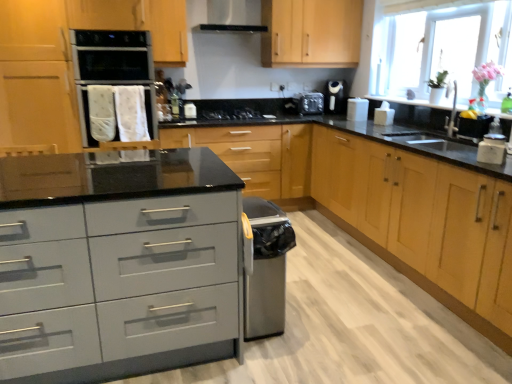
This screenshot has width=512, height=384. What do you see at coordinates (120, 287) in the screenshot?
I see `matte gray drawer at center` at bounding box center [120, 287].

I want to click on satin grey drawers at center, the second cabinetry when ordered from right to left, so click(x=390, y=205).

I want to click on matte wood oven at left, arranged as the 3th cabinetry when viewed from the right, so click(68, 59).

Find the location of a particular element. Image resolution: width=512 pixels, height=384 pixels. transparent glass window at upper right is located at coordinates (440, 48).

Between black matte gas stove at center and satin black oven at upper center, which one has smaller size?

black matte gas stove at center is smaller.

Is black matte gas stove at center positioned far away from satin black oven at upper center?

Yes, black matte gas stove at center is far from satin black oven at upper center.

Is black matte gas stove at center behind satin black oven at upper center?

Yes, black matte gas stove at center is further from the viewer.

Is black matte gas stove at center looking in the opposite direction of satin black oven at upper center?

No.

Which object is further away from the camera, transparent glass window at upper right or white glossy toaster at upper right, which is the first appliance from right to left?

white glossy toaster at upper right, which is the first appliance from right to left, is more distant.

Could you tell me if transparent glass window at upper right is turned towards white glossy toaster at upper right, arranged as the 3th appliance when viewed from the left?

No, transparent glass window at upper right does not turn towards white glossy toaster at upper right, arranged as the 3th appliance when viewed from the left.

Who is bigger, transparent glass window at upper right or white glossy toaster at upper right, the 3th appliance when ordered from back to front?

With larger size is transparent glass window at upper right.

From a real-world perspective, is transparent glass window at upper right positioned over white glossy toaster at upper right, the first appliance from the front, based on gravity?

Yes.

Considering the positions of point (129, 44) and point (390, 117), is point (129, 44) closer or farther from the camera than point (390, 117)?

Point (129, 44).

Looking at this image, can you see white fabric oven mitts at upper left touching white glossy toaster at upper right, arranged as the 3th appliance when viewed from the left?

No, white fabric oven mitts at upper left is not next to white glossy toaster at upper right, arranged as the 3th appliance when viewed from the left.

From the image's perspective, between white fabric oven mitts at upper left and white glossy toaster at upper right, the first appliance from the front, which one is located above?

From the image's view, white fabric oven mitts at upper left is above.

Is matte wood oven at left, arranged as the 3th cabinetry when viewed from the right, thinner than matte gray drawer at center?

Correct, the width of matte wood oven at left, arranged as the 3th cabinetry when viewed from the right, is less than that of matte gray drawer at center.

In the image, is matte wood oven at left, which is the first cabinetry in left-to-right order, on the left side or the right side of matte gray drawer at center?

From the image, it's evident that matte wood oven at left, which is the first cabinetry in left-to-right order, is to the left of matte gray drawer at center.

Who is bigger, matte wood oven at left, which is the first cabinetry in left-to-right order, or matte gray drawer at center?

With larger size is matte wood oven at left, which is the first cabinetry in left-to-right order.

You are a GUI agent. You are given a task and a screenshot of the screen. Output one action in this format:
    pyautogui.click(x=<x>, y=<y>)
    Task: Click on the drawer below the matte wood oven at left, arranged as the 3th cabinetry when viewed from the right (from the image's perspective)
    This screenshot has height=384, width=512.
    Given the screenshot: What is the action you would take?
    pyautogui.click(x=120, y=287)

Is point (352, 109) behind point (304, 99)?

No, it is not.

Does white glossy toaster at upper right, marked as the 2th appliance in a left-to-right arrangement, come in front of black plastic toaster at upper center, the 1th appliance in the back-to-front sequence?

That is True.

From a real-world perspective, does white glossy toaster at upper right, positioned as the second appliance in back-to-front order, sit lower than black plastic toaster at upper center, which is counted as the third appliance, starting from the front?

Yes, from a real-world perspective, white glossy toaster at upper right, positioned as the second appliance in back-to-front order, is under black plastic toaster at upper center, which is counted as the third appliance, starting from the front.

Looking at this image, from the image's perspective, is white glossy toaster at upper right, the first appliance from the front, over white matte sugar container at right?

Indeed, from the image's perspective, white glossy toaster at upper right, the first appliance from the front, is shown above white matte sugar container at right.

Is white glossy toaster at upper right, the first appliance from the front, oriented towards white matte sugar container at right?

No, white glossy toaster at upper right, the first appliance from the front, does not turn towards white matte sugar container at right.

Which of these two, white glossy toaster at upper right, which is the first appliance from right to left, or white matte sugar container at right, is thinner?

white glossy toaster at upper right, which is the first appliance from right to left, is thinner.

From the picture: Considering the sizes of white glossy toaster at upper right, the 3th appliance when ordered from back to front, and white matte sugar container at right in the image, is white glossy toaster at upper right, the 3th appliance when ordered from back to front, bigger or smaller than white matte sugar container at right?

Considering their sizes, white glossy toaster at upper right, the 3th appliance when ordered from back to front, takes up less space than white matte sugar container at right.

Considering the sizes of objects white matte sugar container at right and matte wood oven at left, arranged as the 3th cabinetry when viewed from the right, in the image provided, who is wider, white matte sugar container at right or matte wood oven at left, arranged as the 3th cabinetry when viewed from the right,?

With larger width is matte wood oven at left, arranged as the 3th cabinetry when viewed from the right.

From a real-world perspective, is white matte sugar container at right under matte wood oven at left, arranged as the 3th cabinetry when viewed from the right?

Yes, from a real-world perspective, white matte sugar container at right is beneath matte wood oven at left, arranged as the 3th cabinetry when viewed from the right.

From the picture: Is white matte sugar container at right facing away from matte wood oven at left, arranged as the 3th cabinetry when viewed from the right?

white matte sugar container at right is not turned away from matte wood oven at left, arranged as the 3th cabinetry when viewed from the right.

Is white matte sugar container at right directly adjacent to matte wood oven at left, which is the first cabinetry in left-to-right order?

white matte sugar container at right and matte wood oven at left, which is the first cabinetry in left-to-right order, are not in contact.

This screenshot has width=512, height=384. I want to click on gas stove that appears below the satin black oven at upper center (from a real-world perspective), so click(x=231, y=114).

Find the location of a particular element. The height and width of the screenshot is (384, 512). the 1st appliance to the left of the transparent glass window at upper right, counting from the anchor's position is located at coordinates (384, 114).

When comparing their distances from white glossy toaster at upper right, arranged as the 3th appliance when viewed from the left, does satin grey drawers at center, the second cabinetry when ordered from right to left, or black matte gas stove at center seem further?

black matte gas stove at center.

Based on their spatial positions, is satin black exhaust hood at upper center or matte wood oven at left, which is the first cabinetry in left-to-right order, further from matte gray drawer at center?

satin black exhaust hood at upper center is further to matte gray drawer at center.

Looking at the image, which one is located further to black matte gas stove at center, satin black exhaust hood at upper center or matte gray drawer at center?

Among the two, matte gray drawer at center is located further to black matte gas stove at center.

When comparing their distances from white glossy toaster at upper right, which is the first appliance from right to left, does white fabric oven mitts at upper left or satin grey drawers at center, positioned as the 2th cabinetry in left-to-right order, seem closer?

satin grey drawers at center, positioned as the 2th cabinetry in left-to-right order, is positioned closer to the anchor white glossy toaster at upper right, which is the first appliance from right to left.

When comparing their distances from white glossy toaster at upper right, the first appliance from the front, does black plastic toaster at upper center, placed as the first appliance when sorted from left to right, or black matte gas stove at center seem further?

black matte gas stove at center is positioned further to the anchor white glossy toaster at upper right, the first appliance from the front.

Looking at the image, which one is located further to light wood/texture cabinet at right, positioned as the third cabinetry in left-to-right order, satin black exhaust hood at upper center or white glossy toaster at upper right, arranged as the 3th appliance when viewed from the left?

satin black exhaust hood at upper center lies further to light wood/texture cabinet at right, positioned as the third cabinetry in left-to-right order, than the other object.

Considering their positions, is white fabric oven mitts at upper left positioned further to white glossy toaster at upper right, arranged as the 3th appliance when viewed from the left, than white glossy toaster at upper right, which is counted as the second appliance, starting from the front?

The object further to white glossy toaster at upper right, arranged as the 3th appliance when viewed from the left, is white fabric oven mitts at upper left.

Estimate the real-world distances between objects in this image. Which object is further from white fabric oven mitts at upper left, satin black exhaust hood at upper center or matte wood oven at left, which is the first cabinetry in left-to-right order?

Based on the image, satin black exhaust hood at upper center appears to be further to white fabric oven mitts at upper left.

Where is `oven between satin grey drawers at center, positioned as the 2th cabinetry in left-to-right order, and black matte gas stove at center from front to back`? The width and height of the screenshot is (512, 384). oven between satin grey drawers at center, positioned as the 2th cabinetry in left-to-right order, and black matte gas stove at center from front to back is located at coordinates (112, 55).

The image size is (512, 384). I want to click on gas stove situated between white fabric oven mitts at upper left and black plastic toaster at upper center, placed as the third appliance when sorted from right to left, from left to right, so click(x=231, y=114).

This screenshot has width=512, height=384. Identify the location of appliance located between matte gray drawer at center and white glossy toaster at upper right, positioned as the second appliance in back-to-front order, in the depth direction. (384, 114).

At what (x,y) coordinates should I click in order to perform the action: click on exhaust hood between white fabric oven mitts at upper left and light wood/texture cabinet at right, positioned as the third cabinetry in left-to-right order, from left to right. Please return your answer as a coordinate pair (x, y). Looking at the image, I should click on (232, 17).